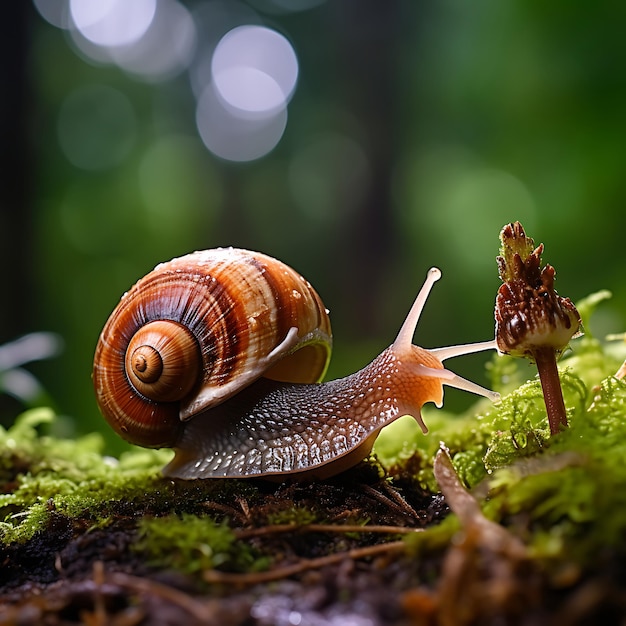
The image size is (626, 626). I want to click on plant, so click(531, 310).